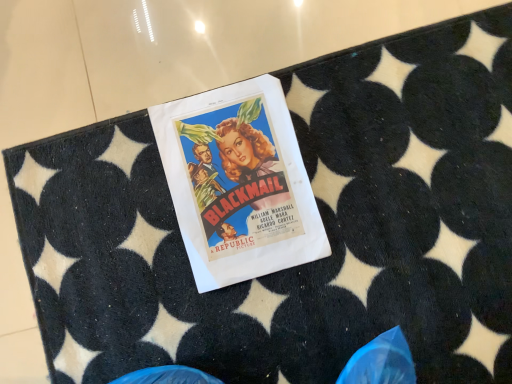
The image size is (512, 384). In order to click on matte paper poster at center in this screenshot , I will do `click(238, 183)`.

This screenshot has height=384, width=512. What do you see at coordinates (238, 183) in the screenshot?
I see `matte paper poster at center` at bounding box center [238, 183].

Image resolution: width=512 pixels, height=384 pixels. In order to click on matte paper poster at center in this screenshot , I will do `click(238, 183)`.